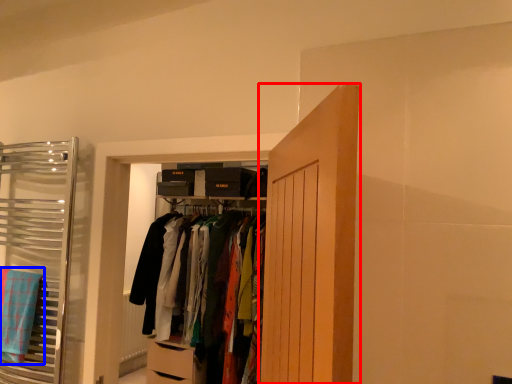
Question: Which of the following is the farthest to the observer, door (highlighted by a red box) or bath towel (highlighted by a blue box)?

Choices:
 (A) door
 (B) bath towel

Answer: (B)